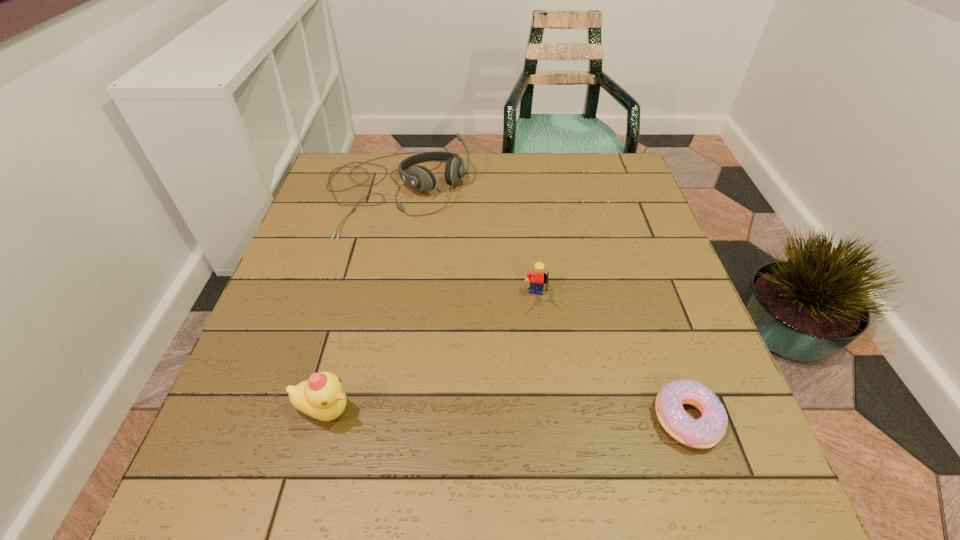
Find the location of `free spot on the desktop that is between the duckling and the doughnut and is positioned on the front-facing side of the second object from right to left`. free spot on the desktop that is between the duckling and the doughnut and is positioned on the front-facing side of the second object from right to left is located at coordinates tap(513, 414).

You are a GUI agent. You are given a task and a screenshot of the screen. Output one action in this format:
    pyautogui.click(x=<x>, y=<y>)
    Task: Click on the free space on the desktop that is between the duckling and the shortest object and is positioned on the outer surface of the farthest object
    This screenshot has width=960, height=540.
    Given the screenshot: What is the action you would take?
    pyautogui.click(x=495, y=414)